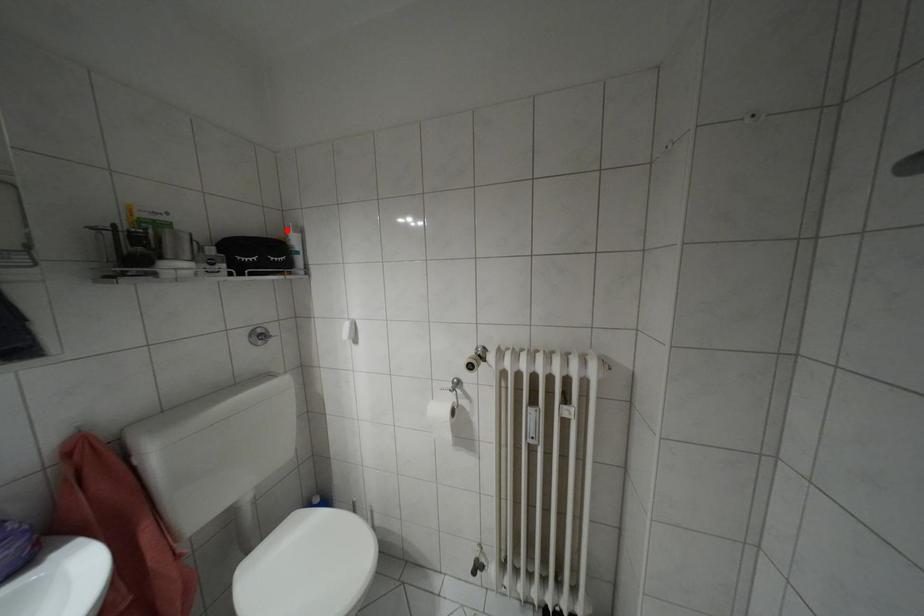
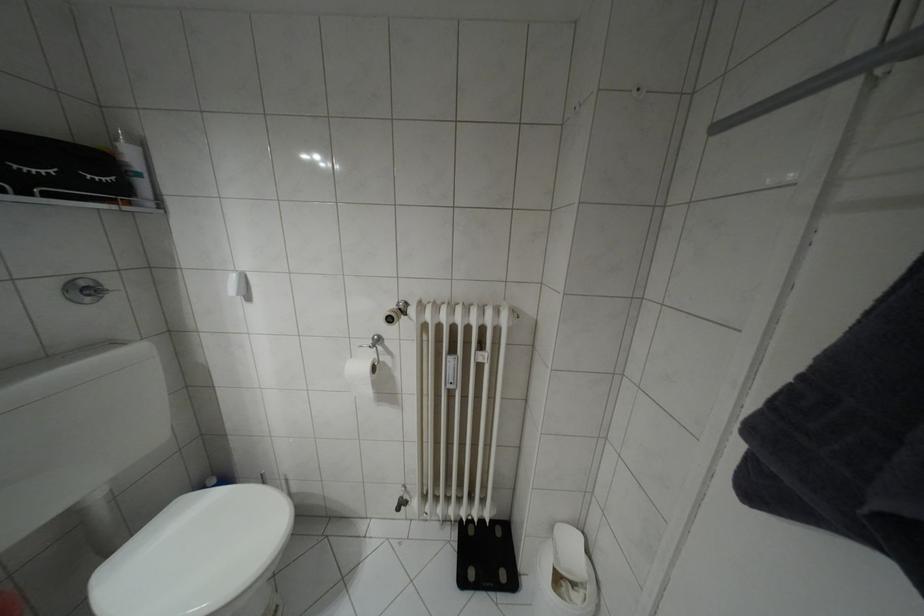
The point at the highlighted location is marked in the first image. Where is the corresponding point in the second image?

(116, 139)